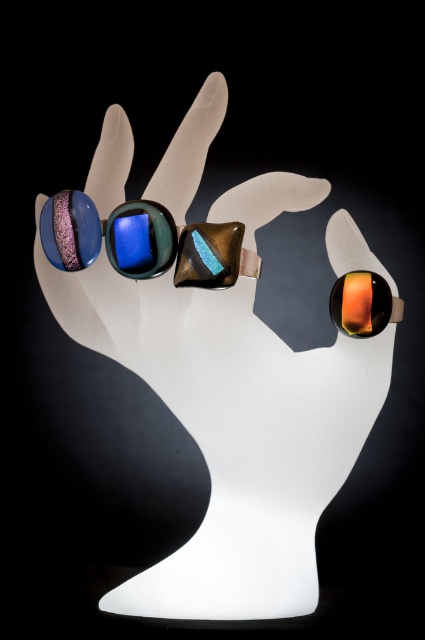
Consider the image. Is shiny blue glass goggles at center to the right of orange glossy ring at upper right from the viewer's perspective?

In fact, shiny blue glass goggles at center is to the left of orange glossy ring at upper right.

Looking at this image, can you confirm if shiny blue glass goggles at center is positioned to the left of orange glossy ring at upper right?

Answer: Correct, you'll find shiny blue glass goggles at center to the left of orange glossy ring at upper right.

Is point (104, 227) less distant than point (377, 310)?

Yes.

Identify the location of shiny blue glass goggles at center. (142, 241).